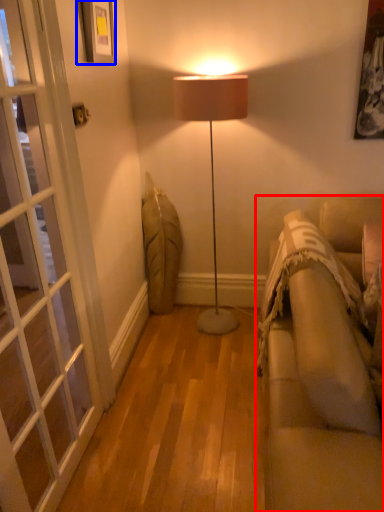
Question: Among these objects, which one is farthest to the camera, studio couch (highlighted by a red box) or picture frame (highlighted by a blue box)?

Choices:
 (A) studio couch
 (B) picture frame

Answer: (B)